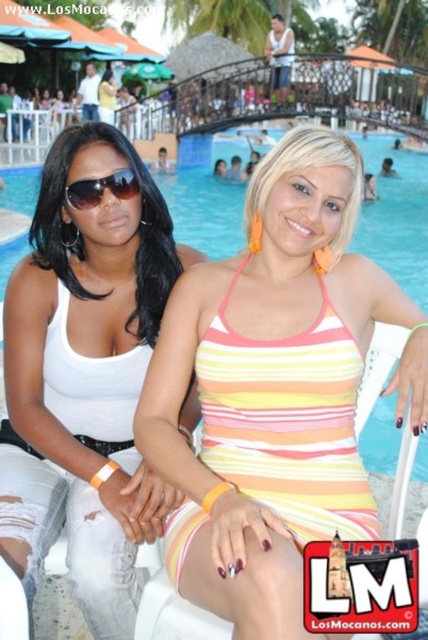
In the scene shown: Does striped fabric swimsuit at center have a larger size compared to white matte tank top at center?

Yes, striped fabric swimsuit at center is bigger than white matte tank top at center.

Between striped fabric swimsuit at center and white matte tank top at center, which one appears on the right side from the viewer's perspective?

Positioned to the right is striped fabric swimsuit at center.

Who is more forward, (290, 371) or (142, 337)?

Point (290, 371) is in front.

The width and height of the screenshot is (428, 640). Identify the location of striped fabric swimsuit at center. (275, 388).

Is striped fabric swimsuit at center positioned in front of matte black sunglasses at left?

Yes, striped fabric swimsuit at center is in front of matte black sunglasses at left.

Looking at this image, who is positioned more to the right, striped fabric swimsuit at center or matte black sunglasses at left?

From the viewer's perspective, striped fabric swimsuit at center appears more on the right side.

This screenshot has width=428, height=640. I want to click on striped fabric swimsuit at center, so click(275, 388).

You are a GUI agent. You are given a task and a screenshot of the screen. Output one action in this format:
    pyautogui.click(x=<x>, y=<y>)
    Task: Click on the white matte tank top at center
    The height and width of the screenshot is (640, 428).
    Given the screenshot: What is the action you would take?
    pyautogui.click(x=85, y=378)

I want to click on white matte tank top at center, so click(85, 378).